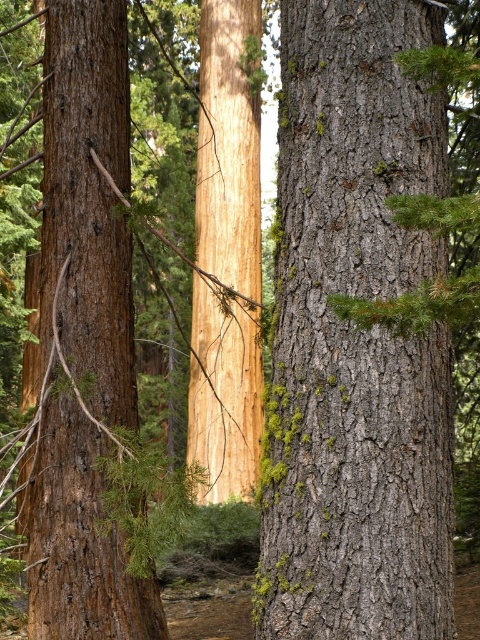
Can you confirm if gray rough bark tree trunk at center is wider than smooth brown bark at left?

Yes, gray rough bark tree trunk at center is wider than smooth brown bark at left.

Does gray rough bark tree trunk at center appear on the left side of smooth brown bark at left?

In fact, gray rough bark tree trunk at center is to the right of smooth brown bark at left.

Does point (380, 561) come closer to viewer compared to point (59, 40)?

Yes, point (380, 561) is closer to viewer.

At what (x,y) coordinates should I click in order to perform the action: click on gray rough bark tree trunk at center. Please return your answer as a coordinate pair (x, y). The width and height of the screenshot is (480, 640). Looking at the image, I should click on (355, 339).